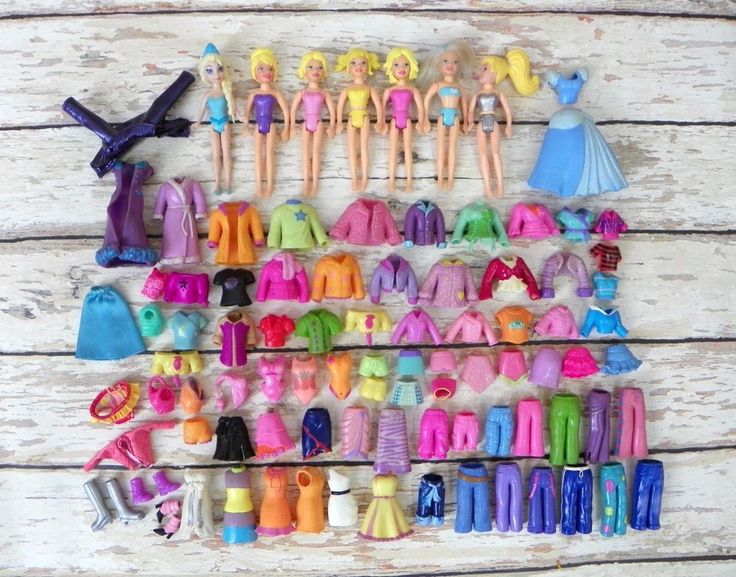
This screenshot has width=736, height=577. Identify the location of plastic toy dress. (241, 505), (274, 502), (311, 496), (336, 494), (381, 499).